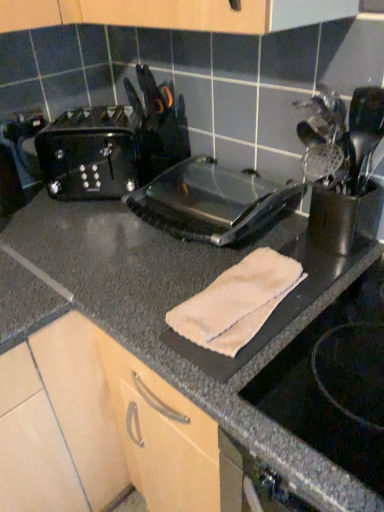
This screenshot has height=512, width=384. I want to click on vacant space situated on the left part of beige cotton towel at center, so click(142, 298).